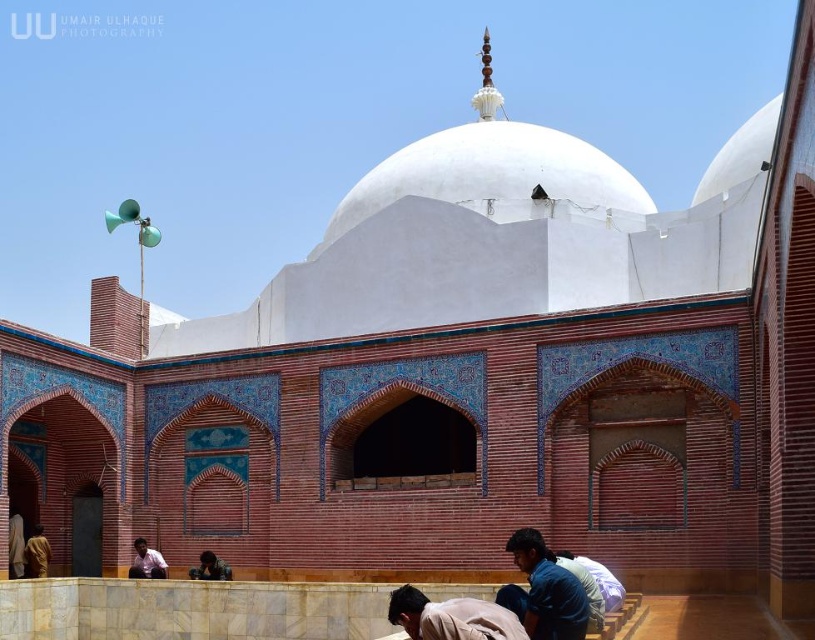
Is light brown fabric at lower center smaller than golden textured robe at lower left?

Incorrect, light brown fabric at lower center is not smaller in size than golden textured robe at lower left.

Is light brown fabric at lower center taller than golden textured robe at lower left?

Yes, light brown fabric at lower center is taller than golden textured robe at lower left.

At what (x,y) coordinates should I click in order to perform the action: click on light brown fabric at lower center. Please return your answer as a coordinate pair (x, y). The width and height of the screenshot is (815, 640). Looking at the image, I should click on (452, 618).

Image resolution: width=815 pixels, height=640 pixels. Find the location of `light brown fabric at lower center`. light brown fabric at lower center is located at coordinates pos(452,618).

Which is above, light brown fabric at lower center or dark brown leather jacket at lower center?

light brown fabric at lower center is above.

Is light brown fabric at lower center smaller than dark brown leather jacket at lower center?

No, light brown fabric at lower center is not smaller than dark brown leather jacket at lower center.

Is point (430, 627) closer to camera compared to point (205, 554)?

Yes, point (430, 627) is closer to viewer.

Where is `light brown fabric at lower center`? This screenshot has width=815, height=640. light brown fabric at lower center is located at coordinates (452, 618).

What are the coordinates of `light brown fabric at lower center` in the screenshot? It's located at (452, 618).

Can you confirm if light brown fabric at lower center is wider than light brown shirt at lower left?

Yes.

Find the location of a particular element. Image resolution: width=815 pixels, height=640 pixels. light brown fabric at lower center is located at coordinates (452, 618).